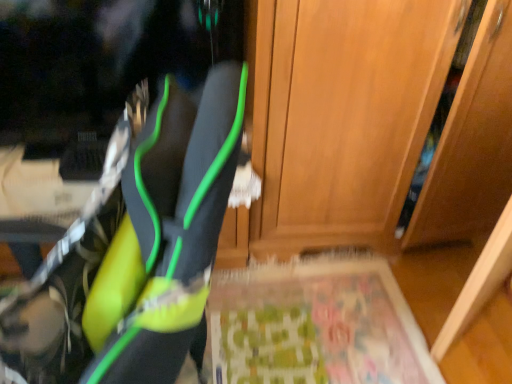
Measure the distance between neon yellow fabric shoe at left and camera.

The depth of neon yellow fabric shoe at left is 17.13 inches.

The height and width of the screenshot is (384, 512). What are the coordinates of `neon yellow fabric shoe at left` in the screenshot? It's located at (168, 230).

This screenshot has height=384, width=512. Identify the location of neon yellow fabric shoe at left. (168, 230).

Are neon yellow fabric shoe at left and wooden door at center making contact?

No, neon yellow fabric shoe at left is not making contact with wooden door at center.

Considering the relative positions of neon yellow fabric shoe at left and wooden door at center in the image provided, is neon yellow fabric shoe at left to the left or to the right of wooden door at center?

In the image, neon yellow fabric shoe at left appears on the left side of wooden door at center.

From a real-world perspective, is neon yellow fabric shoe at left located higher than wooden door at center?

Yes.

In the scene shown: Can you confirm if neon yellow fabric shoe at left is bigger than wooden door at center?

No, neon yellow fabric shoe at left is not bigger than wooden door at center.

Between green fabric yoga mat at lower center and neon yellow fabric shoe at left, which one appears on the right side from the viewer's perspective?

green fabric yoga mat at lower center.

Where is `yoga mat lying below the neon yellow fabric shoe at left (from the image's perspective)`? The height and width of the screenshot is (384, 512). yoga mat lying below the neon yellow fabric shoe at left (from the image's perspective) is located at coordinates (316, 325).

Does point (242, 321) appear closer or farther from the camera than point (149, 115)?

Point (242, 321) is positioned farther from the camera compared to point (149, 115).

From the image's perspective, is green fabric yoga mat at lower center positioned above or below neon yellow fabric shoe at left?

green fabric yoga mat at lower center is situated lower than neon yellow fabric shoe at left in the image.

Would you say wooden door at center is a long distance from green fabric yoga mat at lower center?

They are positioned close to each other.

I want to click on yoga mat lying behind the wooden door at center, so click(x=316, y=325).

From a real-world perspective, is wooden door at center below green fabric yoga mat at lower center?

Incorrect, from a real-world perspective, wooden door at center is higher than green fabric yoga mat at lower center.

How many degrees apart are the facing directions of wooden door at center and green fabric yoga mat at lower center?

There is a 90-degree angle between the facing directions of wooden door at center and green fabric yoga mat at lower center.

From the picture: Would you consider neon yellow fabric shoe at left to be distant from green fabric yoga mat at lower center?

neon yellow fabric shoe at left is far away from green fabric yoga mat at lower center.

Identify the location of footwear above the green fabric yoga mat at lower center (from the image's perspective). (168, 230).

How different are the orientations of neon yellow fabric shoe at left and green fabric yoga mat at lower center in degrees?

The angle between the facing direction of neon yellow fabric shoe at left and the facing direction of green fabric yoga mat at lower center is 137 degrees.

From the image's perspective, would you say wooden door at center is shown under neon yellow fabric shoe at left?

Actually, wooden door at center appears above neon yellow fabric shoe at left in the image.

Is wooden door at center surrounding neon yellow fabric shoe at left?

No, neon yellow fabric shoe at left is not inside wooden door at center.

From the picture: Who is shorter, wooden door at center or neon yellow fabric shoe at left?

neon yellow fabric shoe at left.

From a real-world perspective, relative to neon yellow fabric shoe at left, is wooden door at center vertically above or below?

wooden door at center is situated lower than neon yellow fabric shoe at left in the real world.

Is green fabric yoga mat at lower center in contact with wooden door at center?

No, green fabric yoga mat at lower center is not making contact with wooden door at center.

Is green fabric yoga mat at lower center closer to camera compared to wooden door at center?

No, it is not.

In the scene shown: From the image's perspective, would you say green fabric yoga mat at lower center is shown under wooden door at center?

Yes.

From a real-world perspective, is green fabric yoga mat at lower center physically located above or below wooden door at center?

In terms of real-world spatial position, green fabric yoga mat at lower center is below wooden door at center.

You are a GUI agent. You are given a task and a screenshot of the screen. Output one action in this format:
    pyautogui.click(x=<x>, y=<y>)
    Task: Click on the footwear that appears above the wooden door at center (from a real-world perspective)
    The height and width of the screenshot is (384, 512).
    Given the screenshot: What is the action you would take?
    pyautogui.click(x=168, y=230)

The height and width of the screenshot is (384, 512). I want to click on yoga mat below the neon yellow fabric shoe at left (from the image's perspective), so click(316, 325).

From the image, which object appears to be farther from green fabric yoga mat at lower center, neon yellow fabric shoe at left or wooden door at center?

neon yellow fabric shoe at left.

Based on their spatial positions, is green fabric yoga mat at lower center or neon yellow fabric shoe at left further from wooden door at center?

neon yellow fabric shoe at left.

When comparing their distances from wooden door at center, does neon yellow fabric shoe at left or green fabric yoga mat at lower center seem further?

Among the two, neon yellow fabric shoe at left is located further to wooden door at center.

Based on the photo, estimate the real-world distances between objects in this image. Which object is closer to neon yellow fabric shoe at left, green fabric yoga mat at lower center or wooden door at center?

wooden door at center lies closer to neon yellow fabric shoe at left than the other object.

Looking at the image, which one is located further to neon yellow fabric shoe at left, wooden door at center or green fabric yoga mat at lower center?

green fabric yoga mat at lower center.

From the image, which object appears to be nearer to green fabric yoga mat at lower center, wooden door at center or neon yellow fabric shoe at left?

wooden door at center.

I want to click on yoga mat situated between neon yellow fabric shoe at left and wooden door at center from left to right, so click(x=316, y=325).